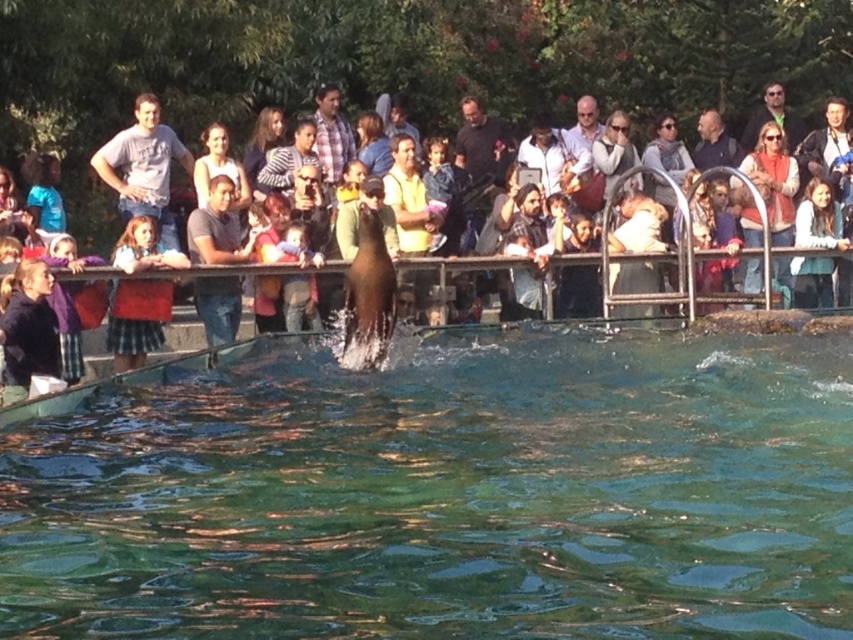
Does point (209, 612) come farther from viewer compared to point (338, 163)?

No, it is in front of (338, 163).

Does clear blue water at center appear on the right side of plaid shirt at center?

Correct, you'll find clear blue water at center to the right of plaid shirt at center.

Based on the photo, who is more distant from viewer, [15,577] or [318,161]?

The point [318,161] is behind.

Locate an element on the screen. The image size is (853, 640). clear blue water at center is located at coordinates (447, 493).

Consider the image. Does plaid skirt at lower left appear under white shirt at center?

Correct, plaid skirt at lower left is located below white shirt at center.

Does plaid skirt at lower left have a smaller size compared to white shirt at center?

Correct, plaid skirt at lower left occupies less space than white shirt at center.

What do you see at coordinates (137, 320) in the screenshot?
I see `plaid skirt at lower left` at bounding box center [137, 320].

Identify the location of plaid skirt at lower left. (137, 320).

Which is more to the left, smooth skin crowd at upper center or plaid shirt at center?

plaid shirt at center

Is smooth skin crowd at upper center to the right of plaid shirt at center from the viewer's perspective?

Yes, smooth skin crowd at upper center is to the right of plaid shirt at center.

Is point (210, 272) less distant than point (341, 125)?

That is True.

At what (x,y) coordinates should I click in order to perform the action: click on smooth skin crowd at upper center. Please return your answer as a coordinate pair (x, y). This screenshot has width=853, height=640. Looking at the image, I should click on (677, 241).